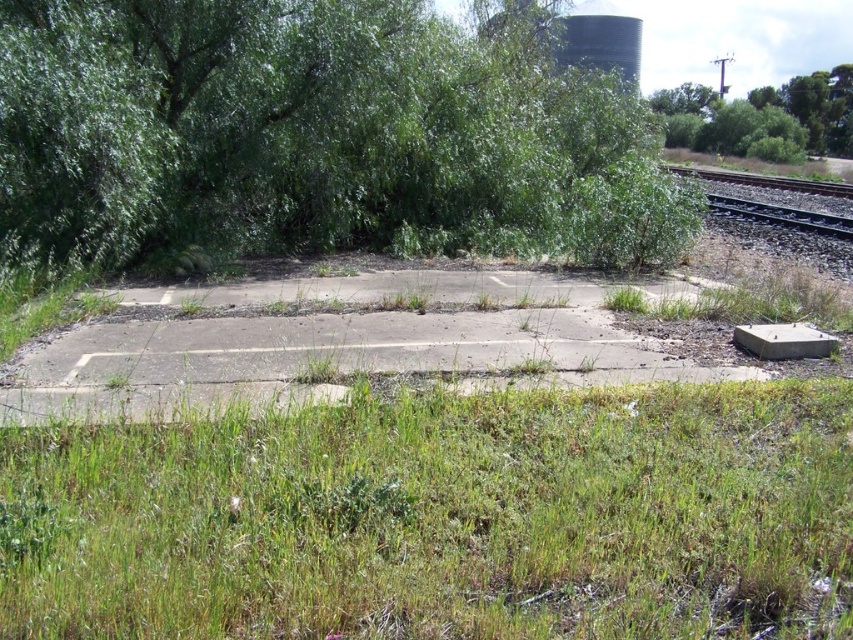
Question: Can you confirm if green grass at lower center is smaller than green leafy tree at upper right?

Choices:
 (A) yes
 (B) no

Answer: (A)

Question: Observing the image, what is the correct spatial positioning of green leafy tree at upper left in reference to green leafy tree at upper right?

Choices:
 (A) below
 (B) above

Answer: (A)

Question: Which of the following is the farthest from the observer?

Choices:
 (A) green grass at lower center
 (B) green leafy tree at upper right

Answer: (B)

Question: Which point is farther to the camera?

Choices:
 (A) (192, 524)
 (B) (677, 92)
 (C) (489, 76)

Answer: (B)

Question: Which object is positioned closest to the green leafy tree at upper right?

Choices:
 (A) green leafy tree at upper left
 (B) green grass at lower center

Answer: (A)

Question: Observing the image, what is the correct spatial positioning of green grass at lower center in reference to green leafy tree at upper left?

Choices:
 (A) above
 (B) below

Answer: (B)